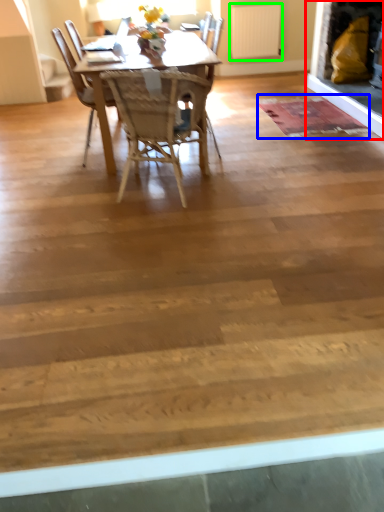
Question: Considering the real-world distances, which object is closest to fireplace (highlighted by a red box)? mat (highlighted by a blue box) or radiator (highlighted by a green box).

Choices:
 (A) mat
 (B) radiator

Answer: (A)